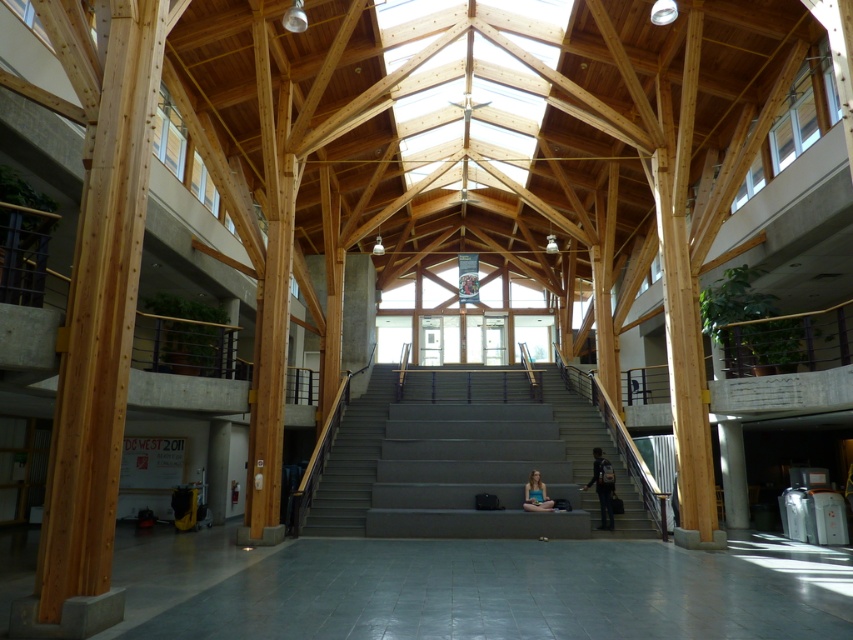
You are standing in the atrium and want to place your dark blue backpack at center on the gray tile floor at lower center. Can you fit the backpack entirely on the floor?

The gray tile floor at lower center is larger in size than the dark blue backpack at center, so yes, the backpack can be placed entirely on the floor.

You are standing at the entrance of the atrium and want to reach the upper floor. The gray concrete stairs at center are your only option. Can you confirm their exact location relative to the entrance?

The gray concrete stairs at center are located at coordinates point (x=466, y=456), so they are positioned towards the center of the atrium. Since you are at the entrance, you should head toward the center area to find the stairs.